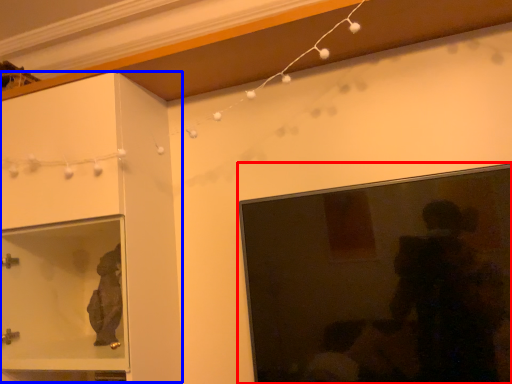
Question: Which of the following is the closest to the observer, picture frame (highlighted by a red box) or cabinetry (highlighted by a blue box)?

Choices:
 (A) picture frame
 (B) cabinetry

Answer: (A)